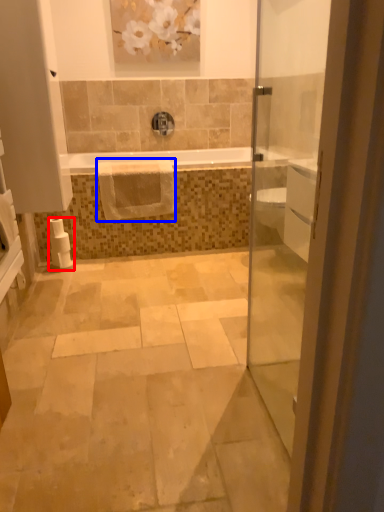
Question: Which object appears farthest to the camera in this image, toilet paper (highlighted by a red box) or hand towel (highlighted by a blue box)?

Choices:
 (A) toilet paper
 (B) hand towel

Answer: (B)